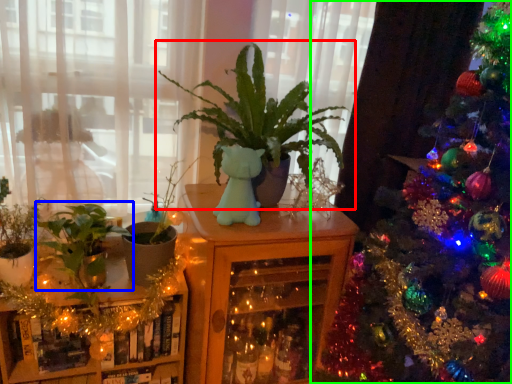
Question: Considering the real-world distances, which object is closest to houseplant (highlighted by a red box)? houseplant (highlighted by a blue box) or christmas tree (highlighted by a green box).

Choices:
 (A) houseplant
 (B) christmas tree

Answer: (B)